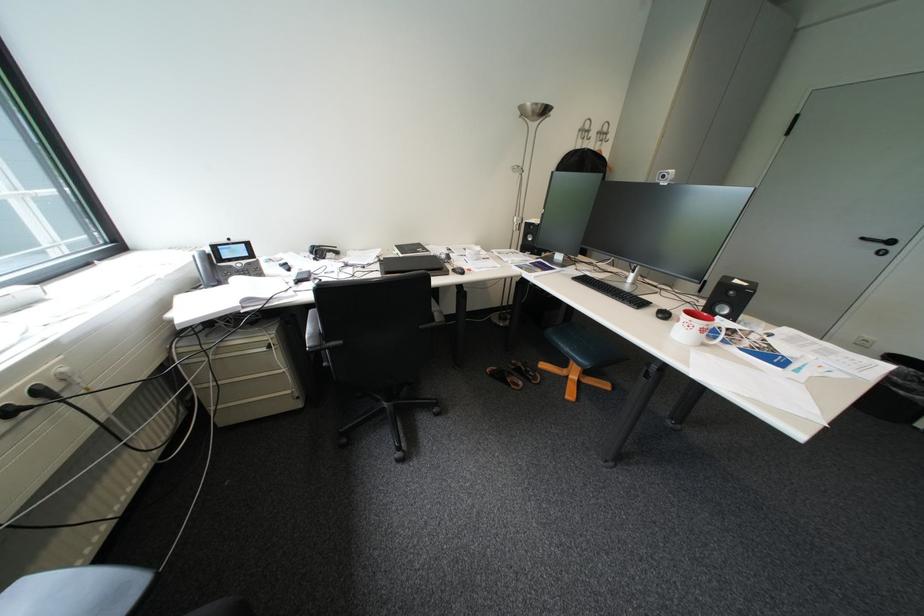
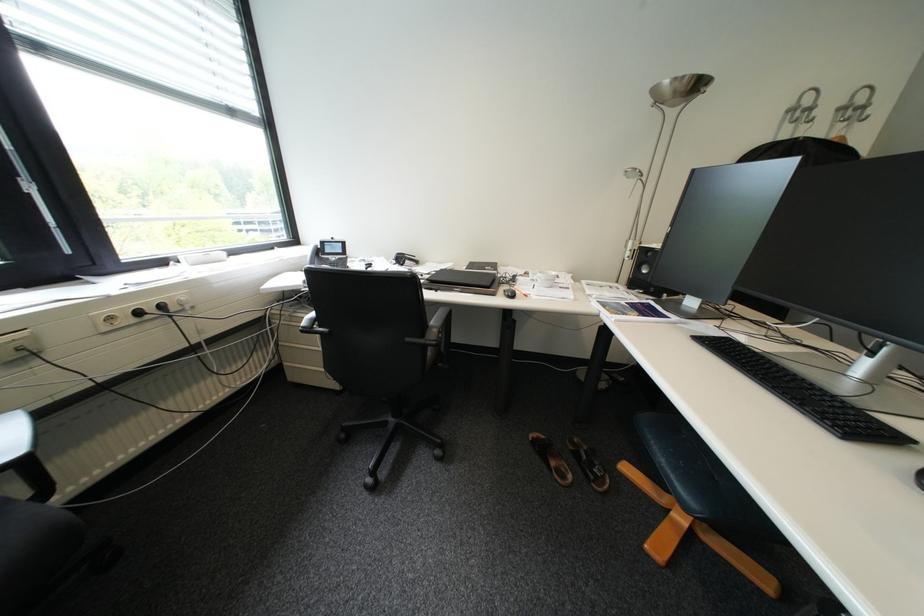
Question: How did the camera likely rotate?

Choices:
 (A) Left
 (B) Right
 (C) Up
 (D) Down

Answer: (A)